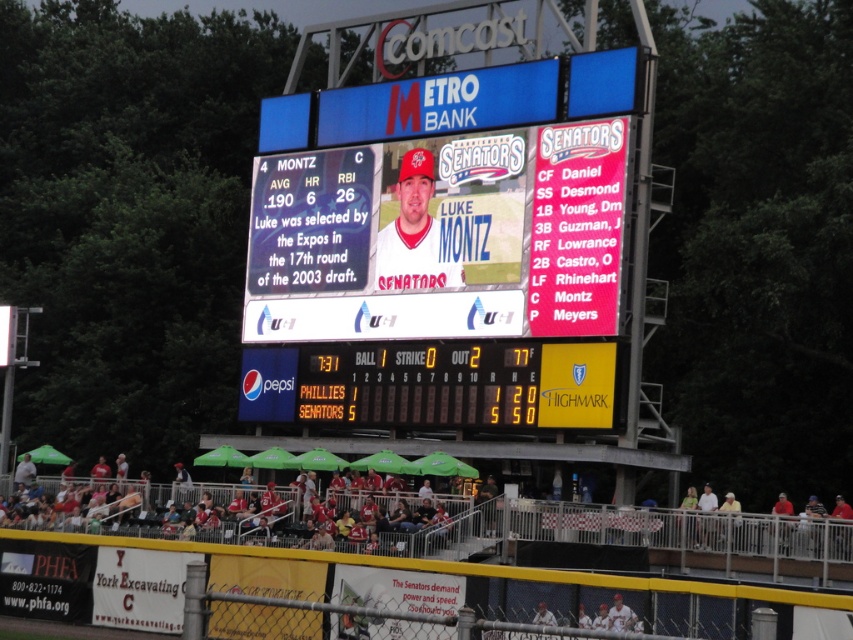
You are a spectator sitting in the red fabric seats at lower center, looking at the matte plastic scoreboard at center. Which object is taller?

The matte plastic scoreboard at center is taller than the red fabric seats at lower center.

You are a spectator sitting on the red fabric seats at lower center and want to check the score. Which direction should you turn your head to look at the matte plastic scoreboard at center?

The matte plastic scoreboard at center is to the right of the red fabric seats at lower center, so you should turn your head to the right to look at it.